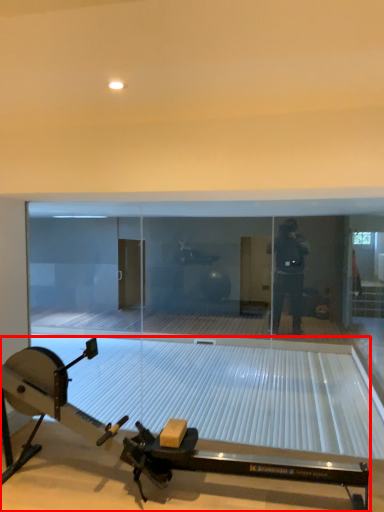
Question: From the image's perspective, considering the relative positions of sport equipment (annotated by the red box) and glass door in the image provided, where is sport equipment (annotated by the red box) located with respect to the staircase?

Choices:
 (A) above
 (B) below

Answer: (B)